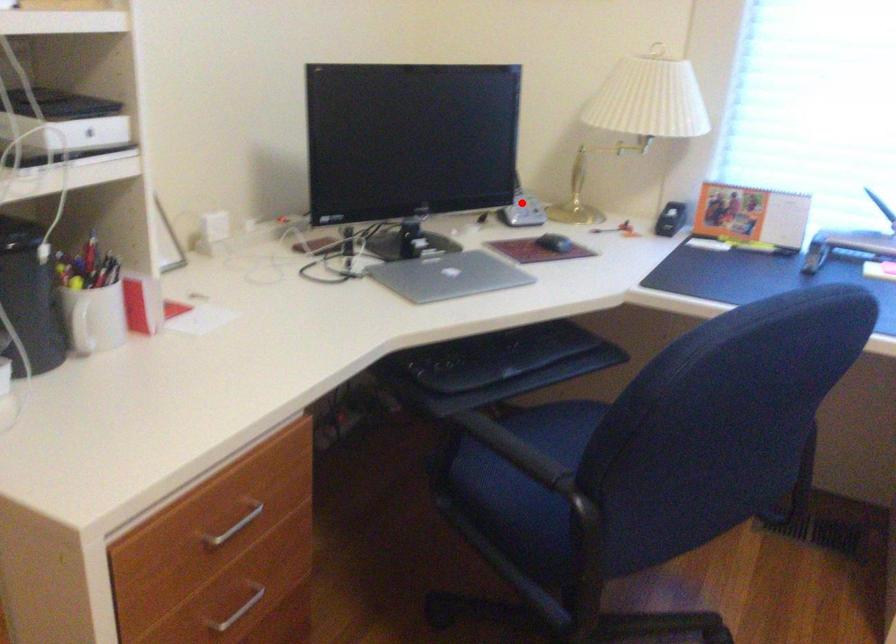
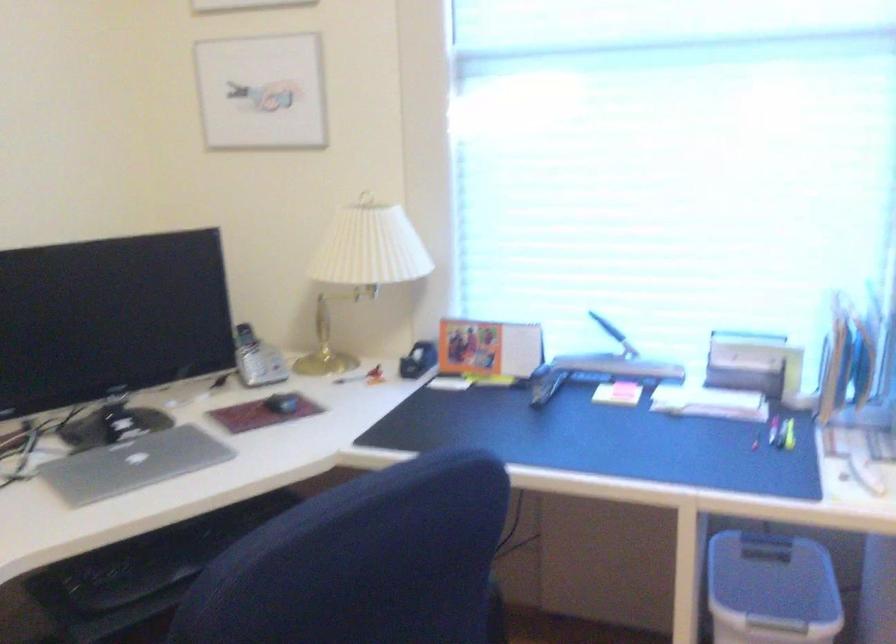
Where in the second image is the point corresponding to the highlighted location from the first image?

(256, 359)